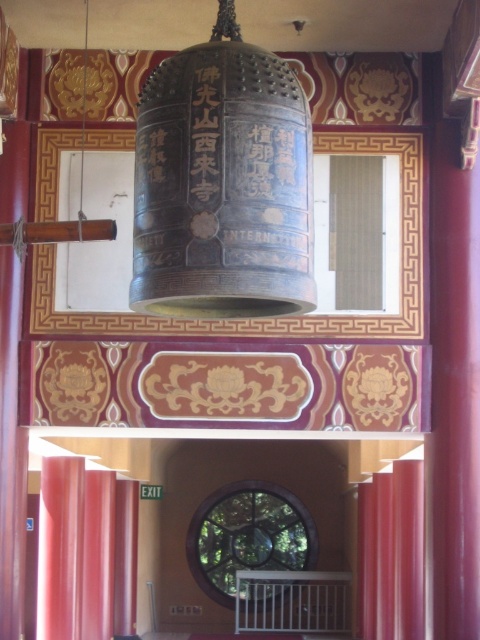
Can you confirm if matte red curtain at lower left is positioned above matte red curtain at right?

Indeed, matte red curtain at lower left is positioned over matte red curtain at right.

Is matte red curtain at lower left behind matte red curtain at right?

No, matte red curtain at lower left is closer to the viewer.

The width and height of the screenshot is (480, 640). Find the location of `matte red curtain at lower left`. matte red curtain at lower left is located at coordinates (84, 552).